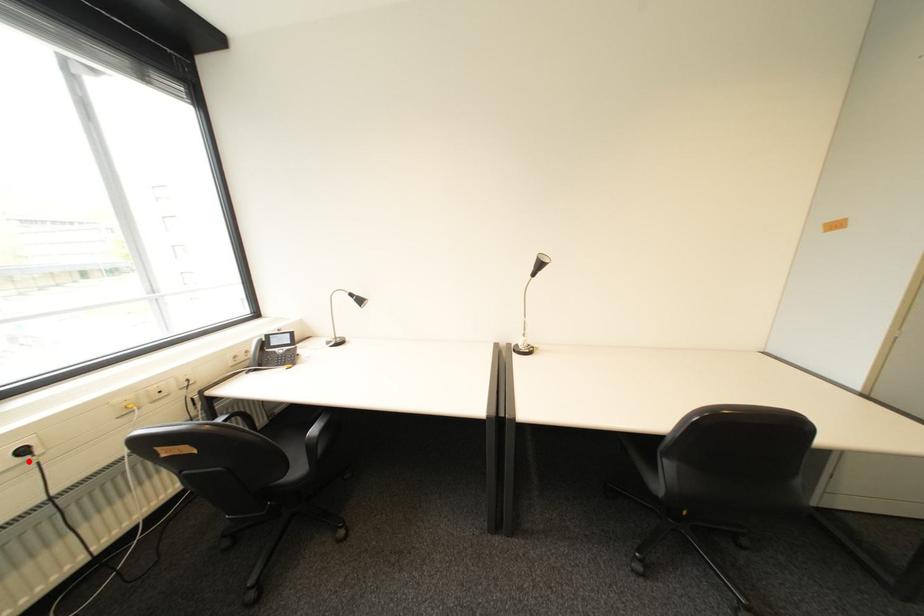
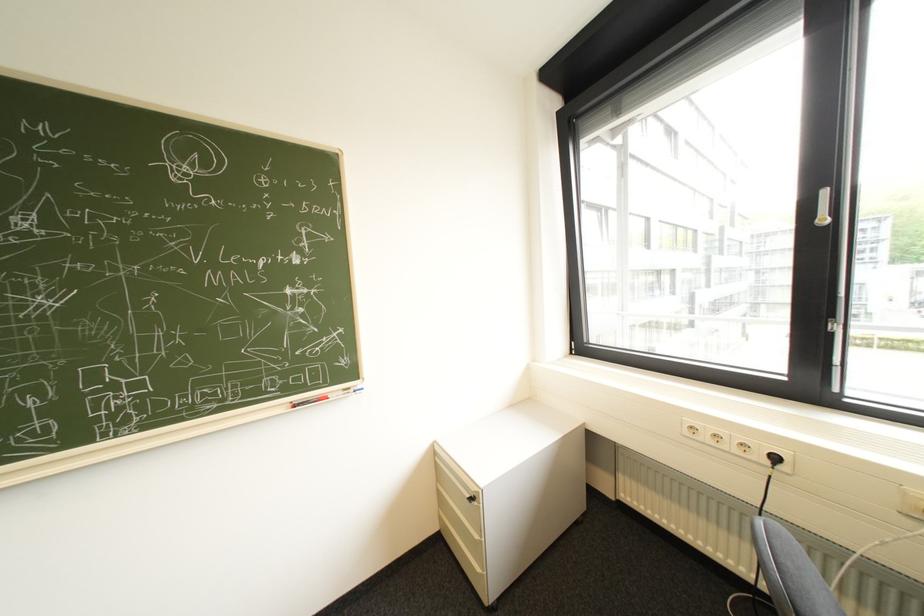
Where in the second image is the point corresponding to the highlighted location from the first image?

(779, 463)